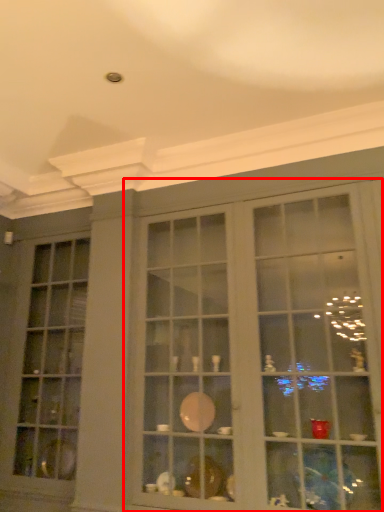
Question: From the image's perspective, what is the correct spatial relationship of shelf (annotated by the red box) in relation to window?

Choices:
 (A) above
 (B) below

Answer: (A)